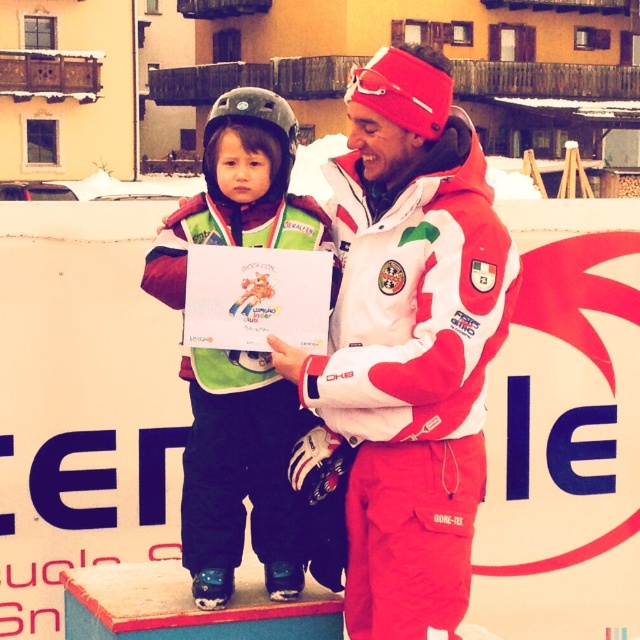
Question: Can you confirm if matte green snowsuit at center is thinner than matte gray helmet at upper center?

Choices:
 (A) yes
 (B) no

Answer: (A)

Question: Among these objects, which one is nearest to the camera?

Choices:
 (A) matte gray helmet at upper center
 (B) matte green snowsuit at center

Answer: (B)

Question: Is white/red ski suit at center thinner than matte green snowsuit at center?

Choices:
 (A) no
 (B) yes

Answer: (B)

Question: Which point is closer to the camera taking this photo?

Choices:
 (A) (312, 202)
 (B) (284, 148)
 (C) (387, 545)

Answer: (C)

Question: Which point is farther to the camera?

Choices:
 (A) (461, 429)
 (B) (282, 184)

Answer: (B)

Question: Can you confirm if white/red ski suit at center is positioned to the left of matte green snowsuit at center?

Choices:
 (A) yes
 (B) no

Answer: (B)